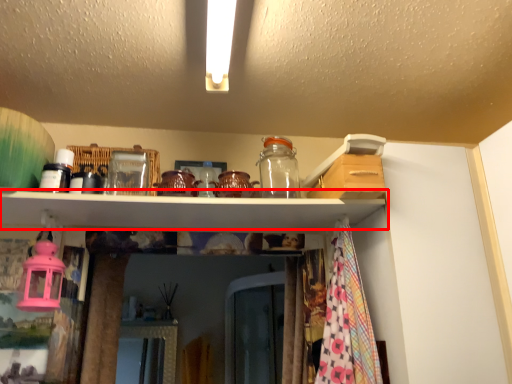
Question: In this image, where is shelf (annotated by the red box) located relative to glass jar?

Choices:
 (A) right
 (B) left

Answer: (B)